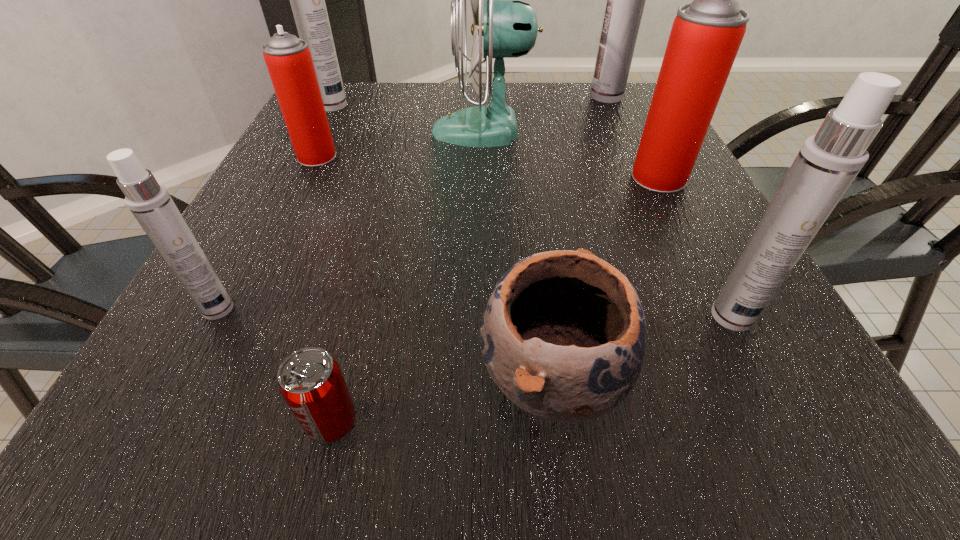
Find the location of a particular element. This screenshot has width=960, height=540. vacant space that satisfies the following two spatial constraints: 1. on the front side of the third biggest white aerosol can; 2. on the right side of the smaller red aerosol can is located at coordinates (239, 316).

I want to click on vacant region that satisfies the following two spatial constraints: 1. on the front side of the sixth object from right to left; 2. on the left side of the smaller red aerosol can, so click(188, 422).